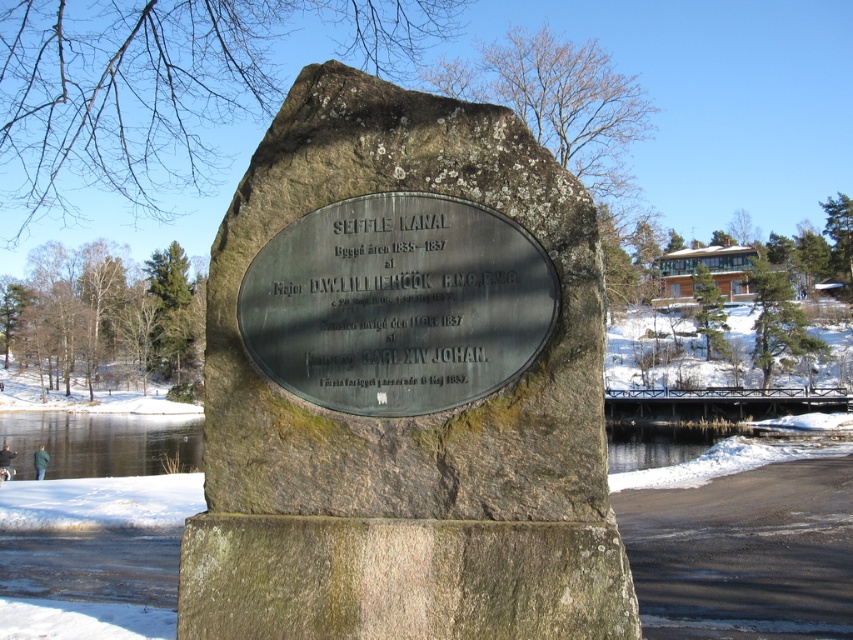
Question: Is green mossy stone monument at center wider than green polished stone plaque at center?

Choices:
 (A) yes
 (B) no

Answer: (A)

Question: Among these objects, which one is nearest to the camera?

Choices:
 (A) green mossy stone monument at center
 (B) green polished stone plaque at center

Answer: (A)

Question: Which of the following is the closest to the observer?

Choices:
 (A) green polished stone plaque at center
 (B) green mossy stone monument at center

Answer: (B)

Question: Which object is closer to the camera taking this photo?

Choices:
 (A) green polished stone plaque at center
 (B) green mossy stone monument at center

Answer: (B)

Question: Does green mossy stone monument at center appear on the right side of green polished stone plaque at center?

Choices:
 (A) no
 (B) yes

Answer: (A)

Question: Does green mossy stone monument at center have a greater width compared to green polished stone plaque at center?

Choices:
 (A) no
 (B) yes

Answer: (B)